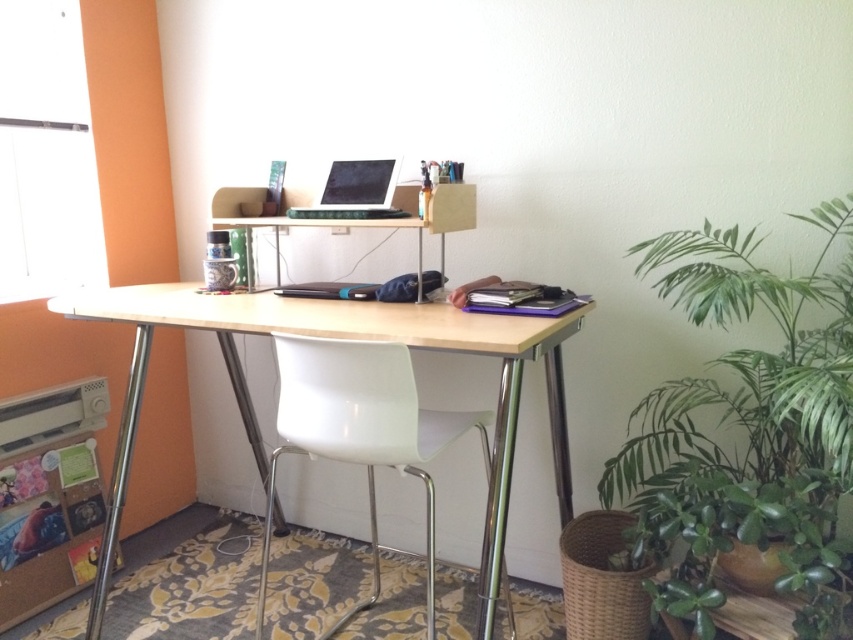
Can you confirm if light wood/wooden desk at center is shorter than white plastic chair at center?

Incorrect, light wood/wooden desk at center's height does not fall short of white plastic chair at center's.

Is light wood/wooden desk at center positioned in front of white plastic chair at center?

Yes, it is.

Image resolution: width=853 pixels, height=640 pixels. Identify the location of light wood/wooden desk at center. click(x=335, y=337).

You are a GUI agent. You are given a task and a screenshot of the screen. Output one action in this format:
    pyautogui.click(x=<x>, y=<y>)
    Task: Click on the light wood/wooden desk at center
    The image size is (853, 640).
    Given the screenshot: What is the action you would take?
    pyautogui.click(x=335, y=337)

Can you confirm if green leafy plant at right is positioned to the left of light wood/wooden desk at center?

Incorrect, green leafy plant at right is not on the left side of light wood/wooden desk at center.

Is green leafy plant at right positioned at the back of light wood/wooden desk at center?

No, it is not.

At what (x,y) coordinates should I click in order to perform the action: click on green leafy plant at right. Please return your answer as a coordinate pair (x, y). Looking at the image, I should click on (747, 428).

Is light wood/wooden desk at center thinner than satin black laptop at center?

In fact, light wood/wooden desk at center might be wider than satin black laptop at center.

Is point (509, 368) in front of point (383, 188)?

Yes, point (509, 368) is closer to viewer.

Between point (193, 326) and point (380, 204), which one is positioned behind?

The point (380, 204) is behind.

The height and width of the screenshot is (640, 853). Identify the location of light wood/wooden desk at center. (335, 337).